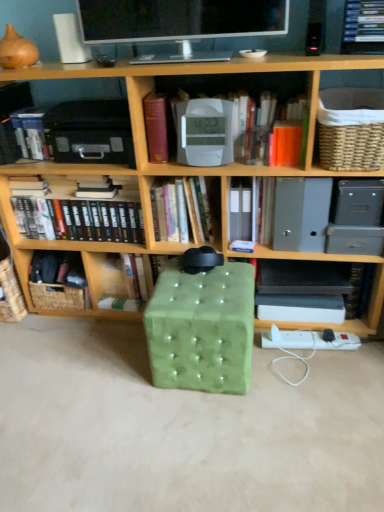
This screenshot has height=512, width=384. I want to click on vacant space in front of green velvet ottoman at center, so click(218, 429).